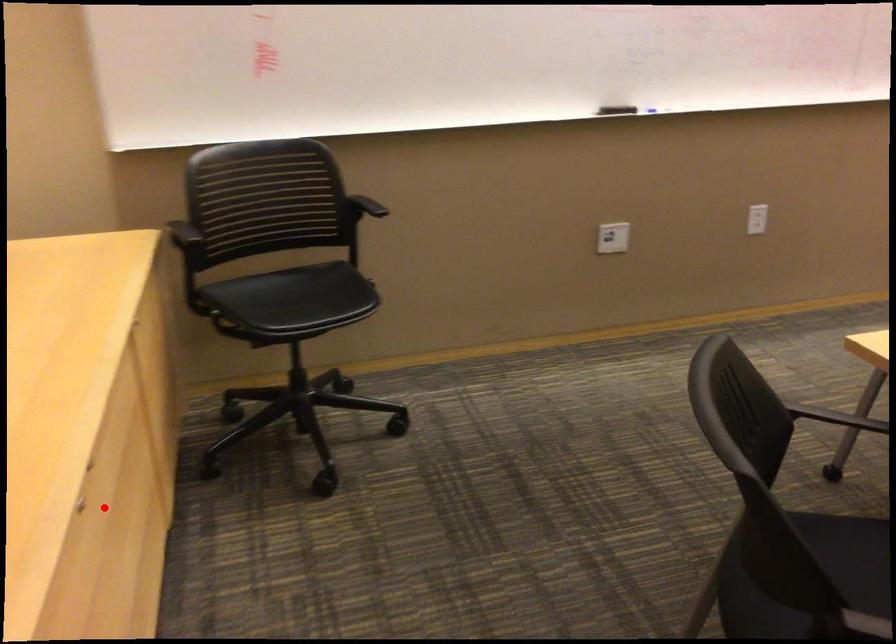
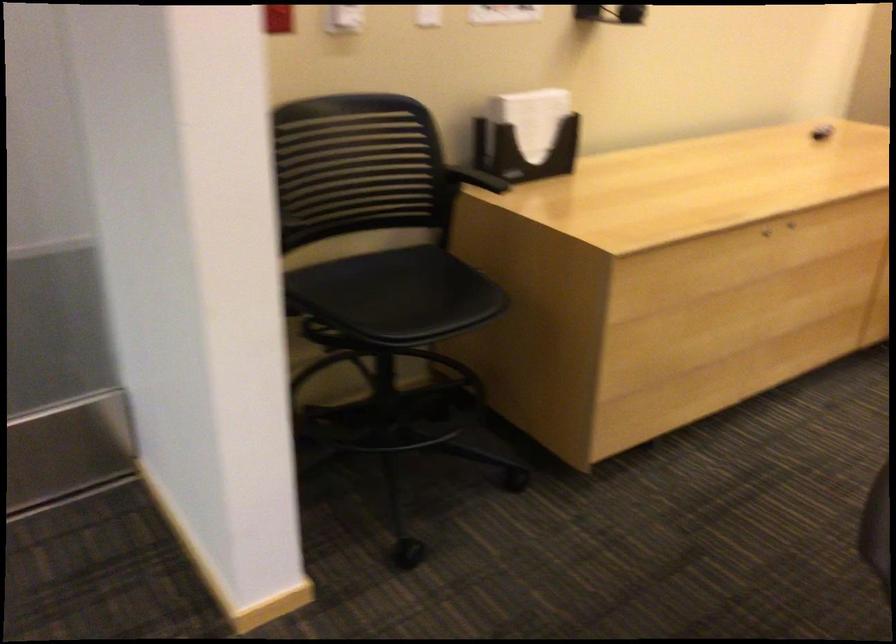
Question: I am providing you with two images of the same scene from different viewpoints. A red point is shown in image1. For the corresponding object point in image2, is it positioned nearer or farther from the camera?

Choices:
 (A) Nearer
 (B) Farther

Answer: (B)